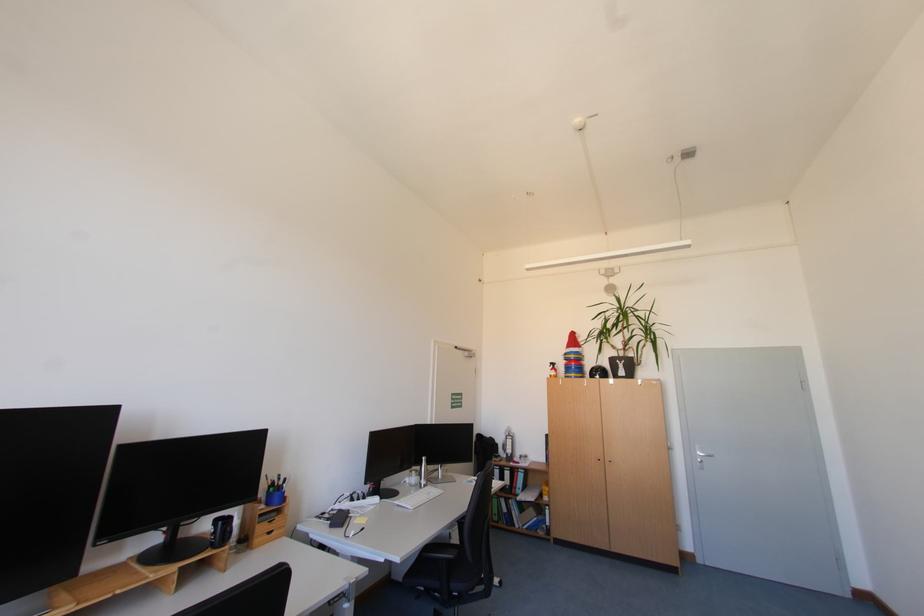
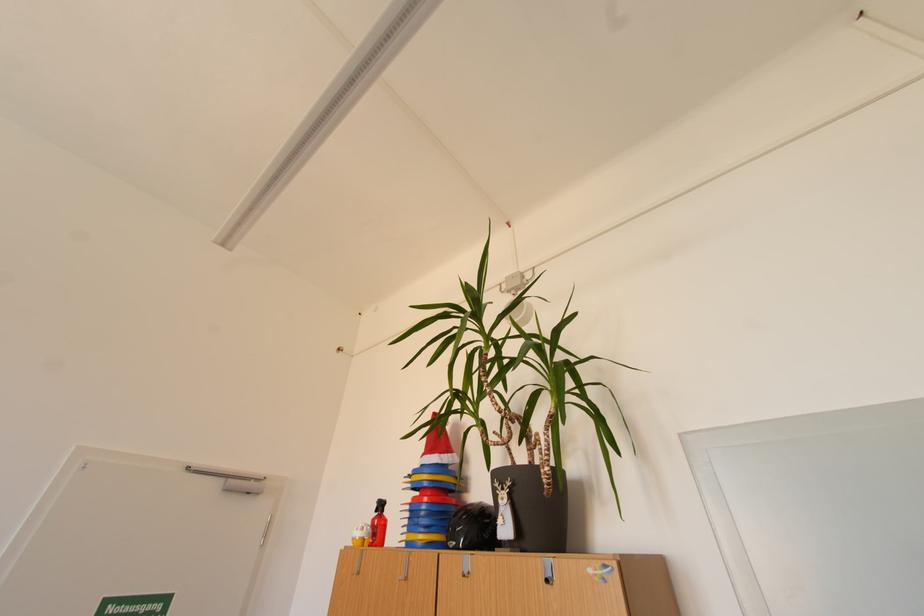
Based on the photo, the images are taken continuously from a first-person perspective. In which direction are you moving?

The cameraman moved toward right, forward.